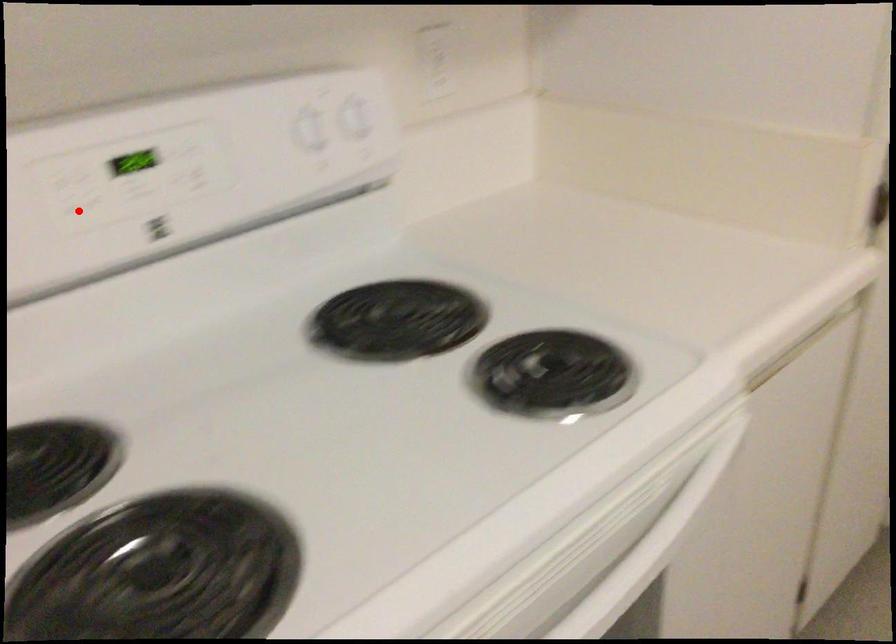
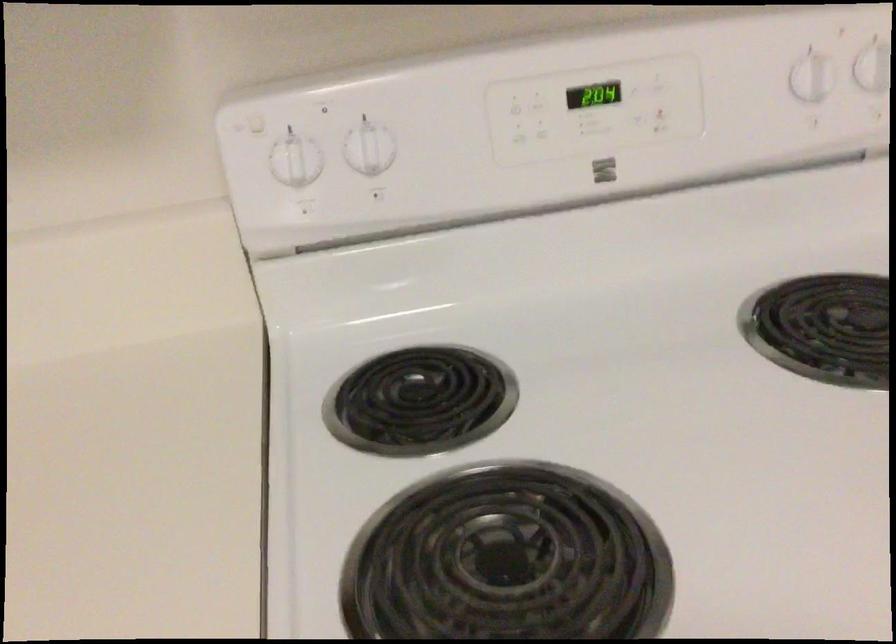
In the second image, find the point that corresponds to the highlighted location in the first image.

(521, 131)